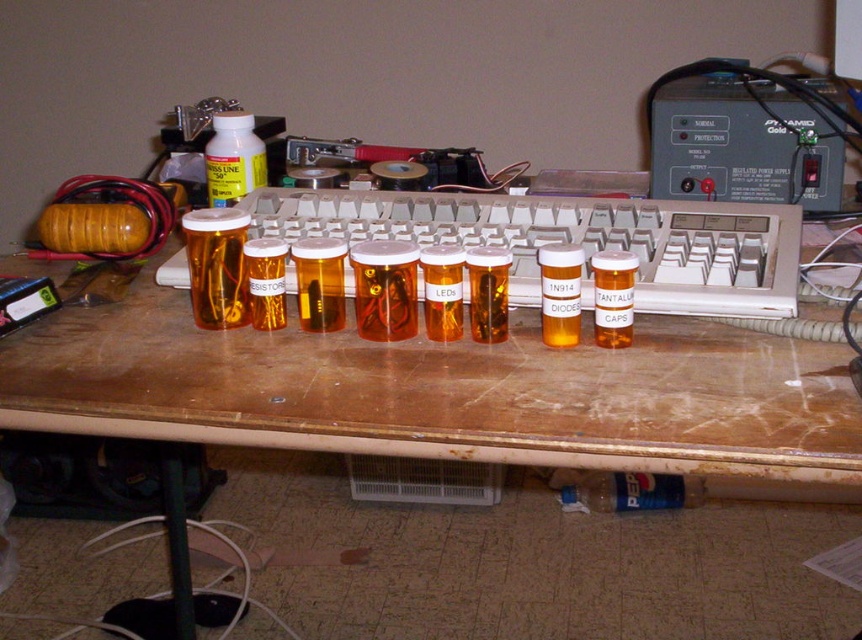
Question: Estimate the real-world distances between objects in this image. Which object is farther from the white plastic bottle at center?

Choices:
 (A) white plastic keyboard at center
 (B) yellow translucent bottle at center

Answer: (B)

Question: Is translucent plastic computer desk at center bigger than white plastic keyboard at center?

Choices:
 (A) no
 (B) yes

Answer: (B)

Question: Does white plastic bottle at center have a greater width compared to orange matte resistor at center?

Choices:
 (A) yes
 (B) no

Answer: (A)

Question: Which object is farther from the camera taking this photo?

Choices:
 (A) orange matte resistor at center
 (B) black plastic power supply at upper right

Answer: (B)

Question: Is white plastic keyboard at center positioned at the back of orange matte resistor at center?

Choices:
 (A) yes
 (B) no

Answer: (B)

Question: Which object is positioned closest to the white plastic bottle at center?

Choices:
 (A) black plastic power supply at upper right
 (B) gold plastic pill bottles at center
 (C) white plastic keyboard at center

Answer: (B)